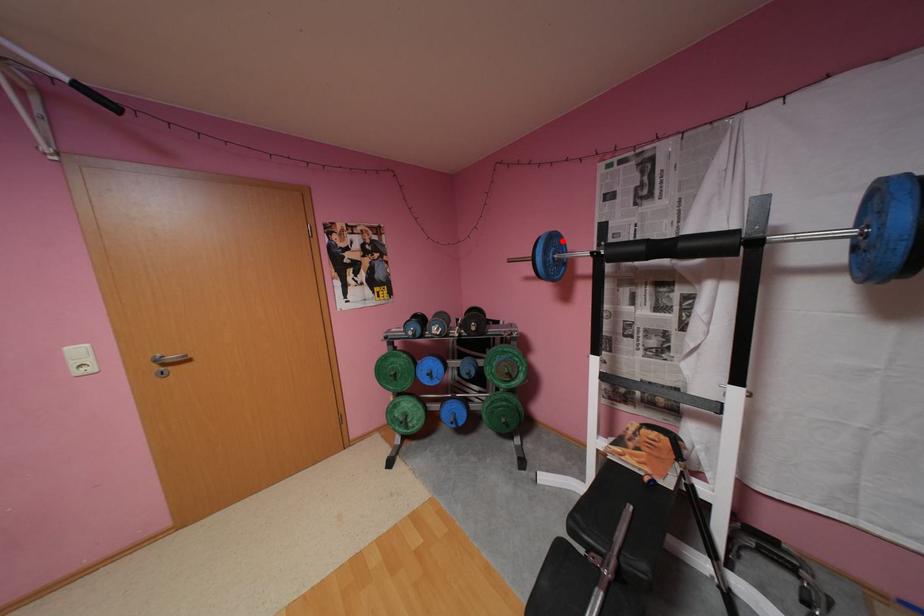
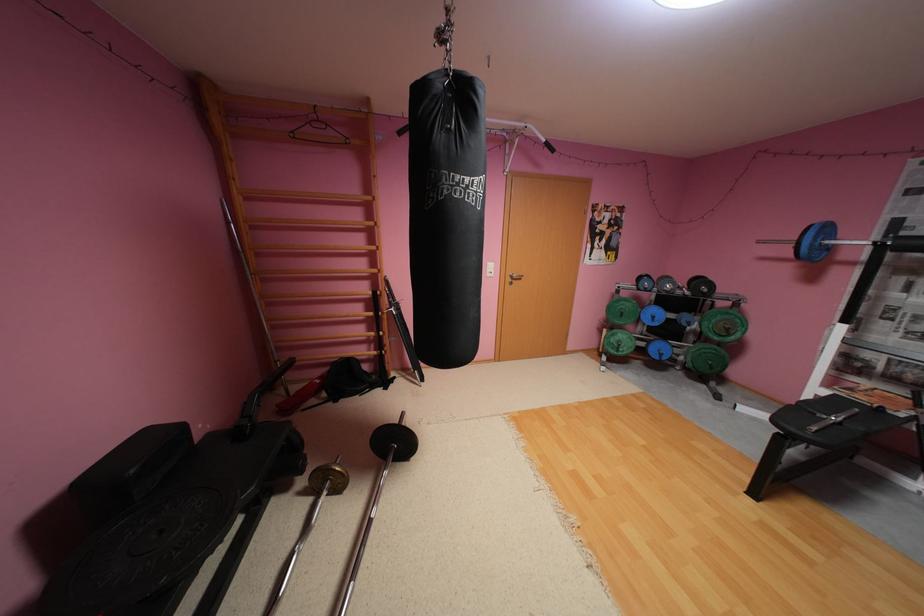
Question: I am providing you with two images of the same scene from different viewpoints. Given a red point in image1, look at the same physical point in image2. Is it:

Choices:
 (A) Closer to the viewpoint
 (B) Farther from the viewpoint

Answer: (B)